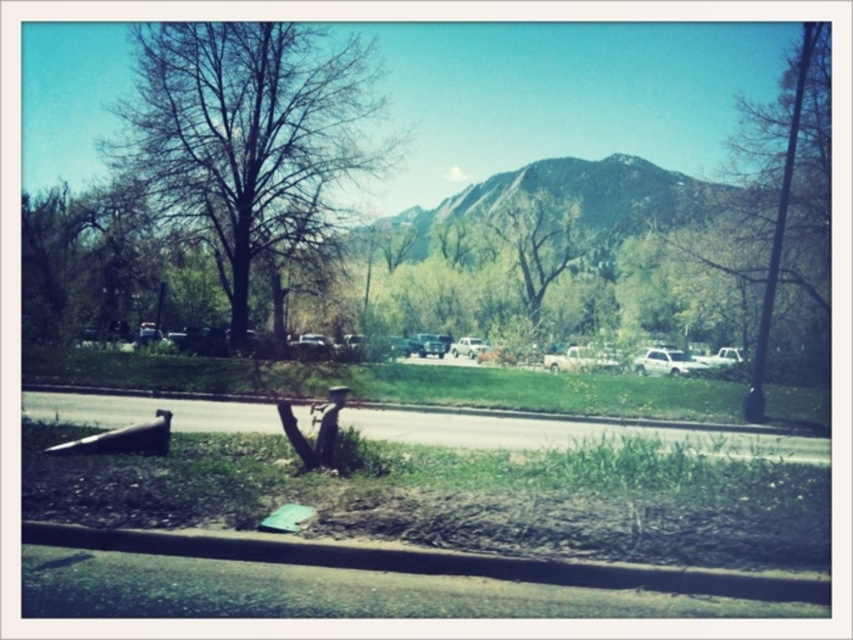
Question: Does white matte suv at center-right come behind metallic silver car at center?

Choices:
 (A) yes
 (B) no

Answer: (B)

Question: Which of the following is the closest to the observer?

Choices:
 (A) grassy patch at lower left
 (B) brown concrete curb at lower center
 (C) green textured mountain at center

Answer: (A)

Question: Can you confirm if white matte truck at center is thinner than white matte suv at center-right?

Choices:
 (A) no
 (B) yes

Answer: (B)

Question: Is the position of black asphalt curb at lower center less distant than that of brown concrete curb at lower center?

Choices:
 (A) no
 (B) yes

Answer: (B)

Question: Which of the following is the farthest from the observer?

Choices:
 (A) white matte truck at center
 (B) green textured mountain at center

Answer: (B)

Question: Which point is closer to the camera?

Choices:
 (A) green leafy tree at center
 (B) white matte truck at center

Answer: (B)